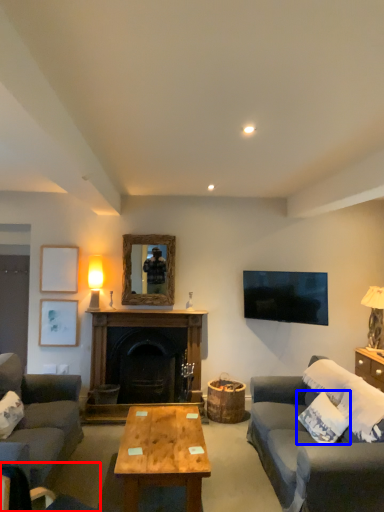
Question: Which object is further to the camera taking this photo, chair (highlighted by a red box) or pillow (highlighted by a blue box)?

Choices:
 (A) chair
 (B) pillow

Answer: (B)